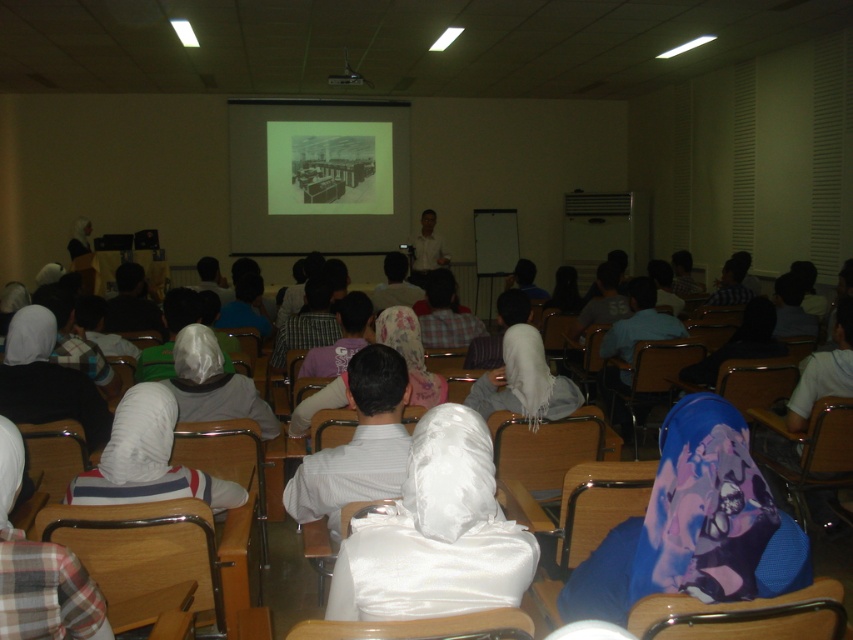
Is wooden chair at lower left wider than dark fabric headscarf at center?

In fact, wooden chair at lower left might be narrower than dark fabric headscarf at center.

Between wooden chair at lower left and dark fabric headscarf at center, which one appears on the right side from the viewer's perspective?

dark fabric headscarf at center

Is point (114, 566) positioned before point (683, 378)?

Yes, point (114, 566) is in front of point (683, 378).

What are the coordinates of `wooden chair at lower left` in the screenshot? It's located at (149, 544).

Is the position of wooden chair at lower left more distant than that of wooden chair at center?

Yes, wooden chair at lower left is further from the viewer.

Between wooden chair at lower left and wooden chair at center, which one appears on the right side from the viewer's perspective?

wooden chair at center is more to the right.

Is point (178, 506) positioned before point (358, 630)?

No, it is not.

This screenshot has width=853, height=640. I want to click on wooden chair at lower left, so click(149, 544).

Which of these two, floral-patterned fabric at center or black plastic projector at upper center, stands taller?

With more height is floral-patterned fabric at center.

Does floral-patterned fabric at center appear over black plastic projector at upper center?

No.

Where is `floral-patterned fabric at center`? The height and width of the screenshot is (640, 853). floral-patterned fabric at center is located at coordinates (694, 525).